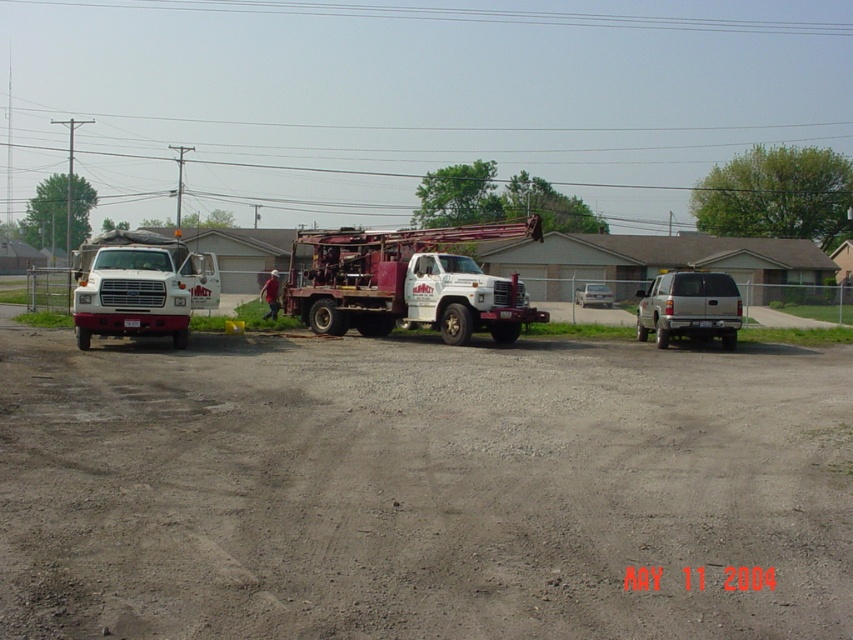
Is gray gravel dirt track at center to the left of white matte truck at left from the viewer's perspective?

Incorrect, gray gravel dirt track at center is not on the left side of white matte truck at left.

Is point (848, 600) positioned in front of point (206, 292)?

Yes, it is in front of point (206, 292).

Locate an element on the screen. gray gravel dirt track at center is located at coordinates (419, 488).

Which is above, white painted metal drill truck at center or metallic wire at upper center?

metallic wire at upper center is higher up.

Is white painted metal drill truck at center to the left of metallic wire at upper center from the viewer's perspective?

Correct, you'll find white painted metal drill truck at center to the left of metallic wire at upper center.

Between point (457, 289) and point (428, 10), which one is positioned behind?

Point (428, 10)

This screenshot has height=640, width=853. Find the location of `white painted metal drill truck at center`. white painted metal drill truck at center is located at coordinates (407, 282).

Can you confirm if gray gravel dirt track at center is wider than brushed metal lift at center?

Yes, gray gravel dirt track at center is wider than brushed metal lift at center.

The width and height of the screenshot is (853, 640). Identify the location of gray gravel dirt track at center. (419, 488).

Find the location of a particular element. This screenshot has height=640, width=853. gray gravel dirt track at center is located at coordinates (419, 488).